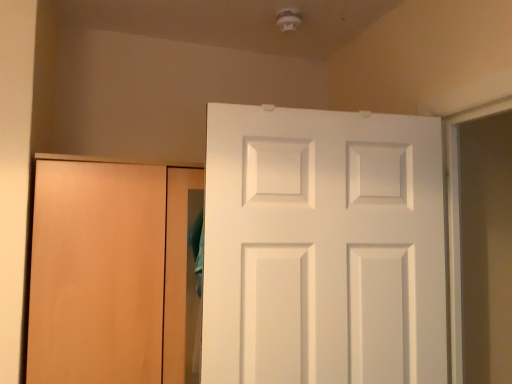
Locate an element on the screen. This screenshot has width=512, height=384. white matte door at center, positioned as the first door in right-to-left order is located at coordinates (323, 248).

In the scene shown: What is the approximate width of white matte door at center, the second door when ordered from left to right?

It is 6.55 inches.

What do you see at coordinates (323, 248) in the screenshot?
I see `white matte door at center, the second door when ordered from left to right` at bounding box center [323, 248].

Measure the distance between white matte door at center, the second door when ordered from left to right, and camera.

They are 3.81 feet apart.

Find the location of a particular element. matte wood door at left, arranged as the 1th door when viewed from the left is located at coordinates (108, 272).

What is the approximate height of matte wood door at left, arranged as the 1th door when viewed from the left?

matte wood door at left, arranged as the 1th door when viewed from the left, is 36.24 inches tall.

Describe the element at coordinates (108, 272) in the screenshot. I see `matte wood door at left, arranged as the 1th door when viewed from the left` at that location.

Identify the location of white matte door at center, positioned as the first door in right-to-left order. The image size is (512, 384). (323, 248).

Does matte wood door at left, arranged as the 1th door when viewed from the left, appear on the left side of white matte door at center, positioned as the first door in right-to-left order?

Correct, you'll find matte wood door at left, arranged as the 1th door when viewed from the left, to the left of white matte door at center, positioned as the first door in right-to-left order.

Which object is further away from the camera taking this photo, matte wood door at left, which ranks as the second door in right-to-left order, or white matte door at center, the second door when ordered from left to right?

matte wood door at left, which ranks as the second door in right-to-left order, is behind.

Is point (173, 275) farther from viewer compared to point (345, 249)?

Yes, point (173, 275) is farther from viewer.

From the image's perspective, which is below, matte wood door at left, which ranks as the second door in right-to-left order, or white matte door at center, the second door when ordered from left to right?

matte wood door at left, which ranks as the second door in right-to-left order, appears lower in the image.

From a real-world perspective, relative to white matte door at center, the second door when ordered from left to right, is matte wood door at left, which ranks as the second door in right-to-left order, vertically above or below?

In terms of real-world spatial position, matte wood door at left, which ranks as the second door in right-to-left order, is below white matte door at center, the second door when ordered from left to right.

Consider the image. Can you confirm if matte wood door at left, arranged as the 1th door when viewed from the left, is thinner than white matte door at center, positioned as the first door in right-to-left order?

In fact, matte wood door at left, arranged as the 1th door when viewed from the left, might be wider than white matte door at center, positioned as the first door in right-to-left order.

Which of these two, matte wood door at left, which ranks as the second door in right-to-left order, or white matte door at center, the second door when ordered from left to right, stands taller?

matte wood door at left, which ranks as the second door in right-to-left order.

Looking at this image, can you confirm if matte wood door at left, which ranks as the second door in right-to-left order, is smaller than white matte door at center, positioned as the first door in right-to-left order?

Incorrect, matte wood door at left, which ranks as the second door in right-to-left order, is not smaller in size than white matte door at center, positioned as the first door in right-to-left order.

Is matte wood door at left, which ranks as the second door in right-to-left order, outside of white matte door at center, positioned as the first door in right-to-left order?

Yes.

Is matte wood door at left, which ranks as the second door in right-to-left order, far from white matte door at center, positioned as the first door in right-to-left order?

No, there isn't a large distance between matte wood door at left, which ranks as the second door in right-to-left order, and white matte door at center, positioned as the first door in right-to-left order.

From the picture: Is matte wood door at left, arranged as the 1th door when viewed from the left, turned away from white matte door at center, positioned as the first door in right-to-left order?

No, white matte door at center, positioned as the first door in right-to-left order, is not at the back of matte wood door at left, arranged as the 1th door when viewed from the left.

Can you tell me how much matte wood door at left, arranged as the 1th door when viewed from the left, and white matte door at center, positioned as the first door in right-to-left order, differ in facing direction?

5.54 degrees.

This screenshot has height=384, width=512. Find the location of `door on the right side of matte wood door at left, which ranks as the second door in right-to-left order`. door on the right side of matte wood door at left, which ranks as the second door in right-to-left order is located at coordinates (323, 248).

Consider the image. Does white matte door at center, the second door when ordered from left to right, appear on the left side of matte wood door at left, arranged as the 1th door when viewed from the left?

In fact, white matte door at center, the second door when ordered from left to right, is to the right of matte wood door at left, arranged as the 1th door when viewed from the left.

Between white matte door at center, positioned as the first door in right-to-left order, and matte wood door at left, arranged as the 1th door when viewed from the left, which one is positioned behind?

matte wood door at left, arranged as the 1th door when viewed from the left, is further from the camera.

Considering the positions of point (232, 205) and point (125, 240), is point (232, 205) closer or farther from the camera than point (125, 240)?

Point (232, 205) is positioned closer to the camera compared to point (125, 240).

From the image's perspective, which is above, white matte door at center, positioned as the first door in right-to-left order, or matte wood door at left, arranged as the 1th door when viewed from the left?

white matte door at center, positioned as the first door in right-to-left order, appears higher in the image.

From a real-world perspective, is white matte door at center, positioned as the first door in right-to-left order, on top of matte wood door at left, which ranks as the second door in right-to-left order?

Correct, in the physical world, white matte door at center, positioned as the first door in right-to-left order, is higher than matte wood door at left, which ranks as the second door in right-to-left order.

Between white matte door at center, positioned as the first door in right-to-left order, and matte wood door at left, arranged as the 1th door when viewed from the left, which one has smaller width?

With smaller width is white matte door at center, positioned as the first door in right-to-left order.

In terms of height, does white matte door at center, positioned as the first door in right-to-left order, look taller or shorter compared to matte wood door at left, which ranks as the second door in right-to-left order?

Clearly, white matte door at center, positioned as the first door in right-to-left order, is shorter compared to matte wood door at left, which ranks as the second door in right-to-left order.

Can you confirm if white matte door at center, the second door when ordered from left to right, is bigger than matte wood door at left, which ranks as the second door in right-to-left order?

Incorrect, white matte door at center, the second door when ordered from left to right, is not larger than matte wood door at left, which ranks as the second door in right-to-left order.

Would you say white matte door at center, the second door when ordered from left to right, is inside or outside matte wood door at left, which ranks as the second door in right-to-left order?

The correct answer is: outside.

Is white matte door at center, positioned as the first door in right-to-left order, looking in the opposite direction of matte wood door at left, arranged as the 1th door when viewed from the left?

That's not correct — white matte door at center, positioned as the first door in right-to-left order, is not looking away from matte wood door at left, arranged as the 1th door when viewed from the left.

Measure the distance between white matte door at center, the second door when ordered from left to right, and matte wood door at left, arranged as the 1th door when viewed from the left.

The distance of white matte door at center, the second door when ordered from left to right, from matte wood door at left, arranged as the 1th door when viewed from the left, is 15.65 inches.

In order to click on door lying on the right of matte wood door at left, arranged as the 1th door when viewed from the left in this screenshot , I will do `click(323, 248)`.

I want to click on door that appears on the right of matte wood door at left, which ranks as the second door in right-to-left order, so click(x=323, y=248).

Where is `door below the white matte door at center, positioned as the first door in right-to-left order (from a real-world perspective)`? door below the white matte door at center, positioned as the first door in right-to-left order (from a real-world perspective) is located at coordinates (108, 272).